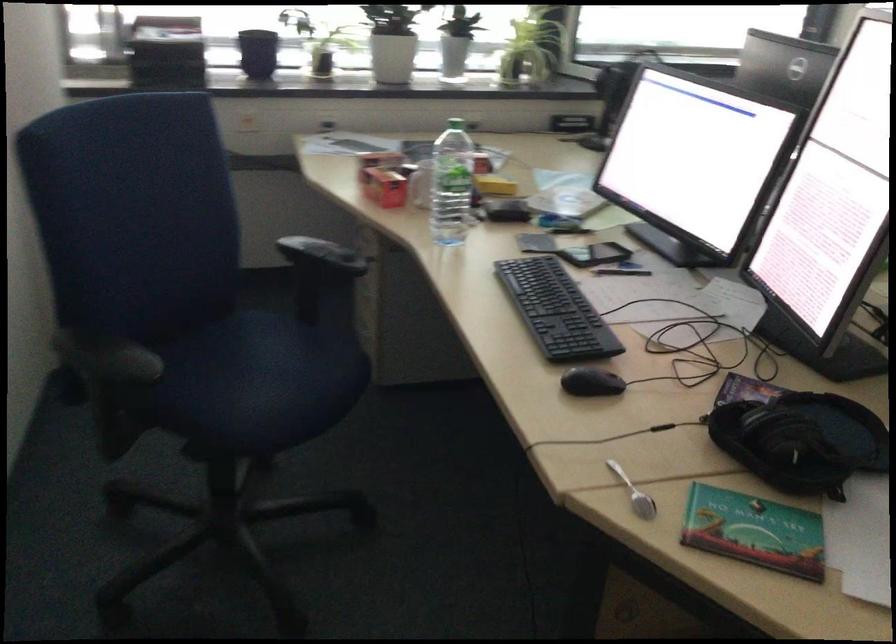
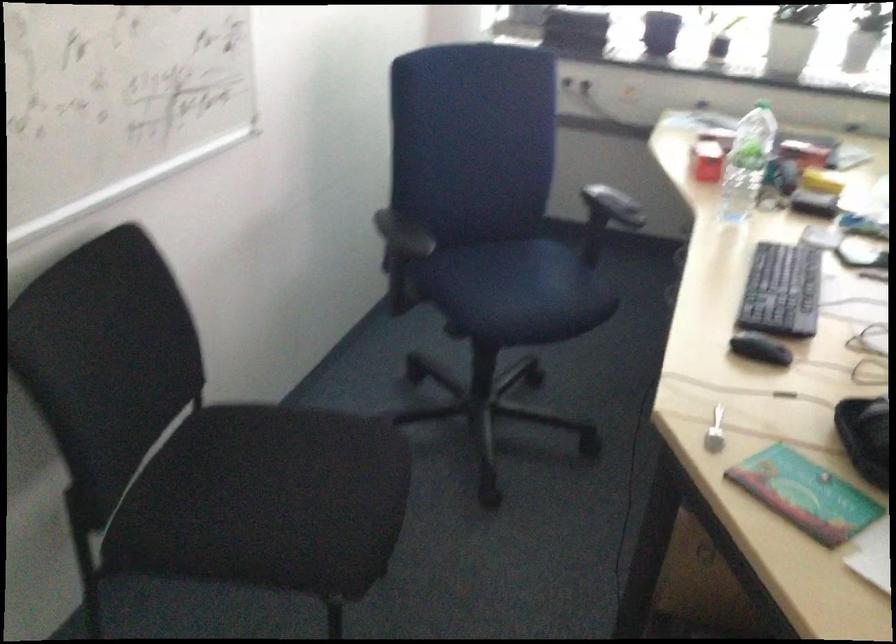
Question: The camera is either moving clockwise (left) or counter-clockwise (right) around the object. The first image is from the beginning of the video and the second image is from the end. Is the camera moving left or right when shooting the video?

Choices:
 (A) Left
 (B) Right

Answer: (B)